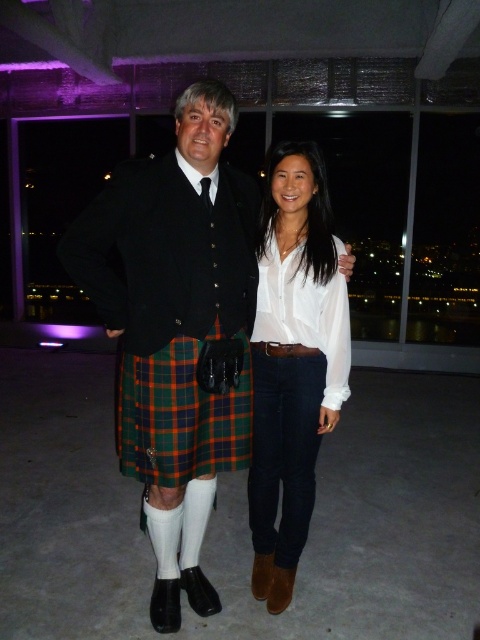
Question: Where is white satin blouse at center located in relation to plaid fabric kilt at center in the image?

Choices:
 (A) above
 (B) below

Answer: (A)

Question: Which of these objects is positioned farthest from the tartan kilt at center?

Choices:
 (A) white satin blouse at center
 (B) plaid fabric kilt at center

Answer: (A)

Question: Which point is closer to the camera?

Choices:
 (A) (159, 564)
 (B) (186, 480)
 (C) (283, 362)

Answer: (B)

Question: Is white satin blouse at center further to camera compared to plaid fabric kilt at center?

Choices:
 (A) no
 (B) yes

Answer: (B)

Question: Which of the following is the closest to the observer?

Choices:
 (A) white satin blouse at center
 (B) plaid fabric kilt at center
 (C) tartan kilt at center

Answer: (C)

Question: Does tartan kilt at center appear on the right side of plaid fabric kilt at center?

Choices:
 (A) yes
 (B) no

Answer: (B)